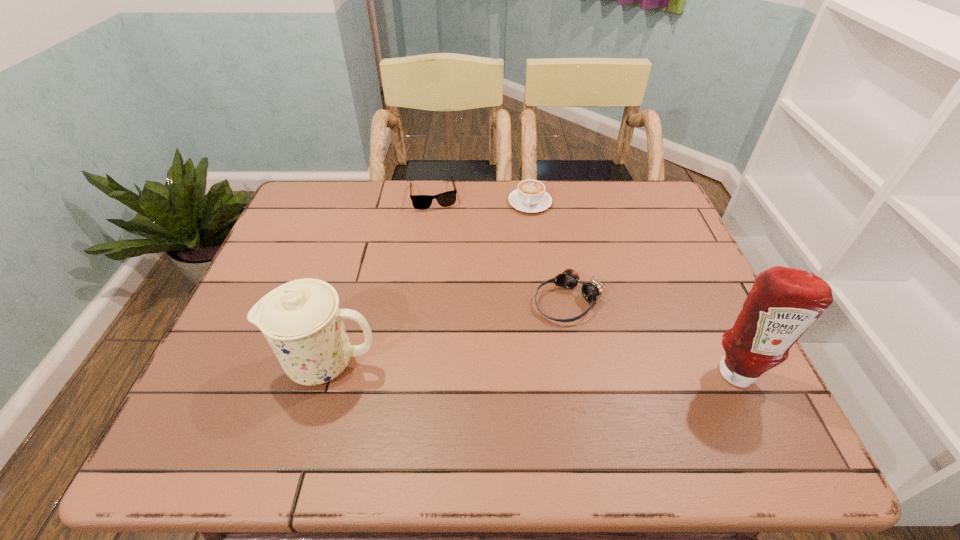
Where is `vacant space on the desktop that is between the fourth shortest object and the condiment and is positioned on the side of the cappuccino with the handle`? The image size is (960, 540). vacant space on the desktop that is between the fourth shortest object and the condiment and is positioned on the side of the cappuccino with the handle is located at coordinates (489, 366).

The height and width of the screenshot is (540, 960). I want to click on free space on the desktop that is between the chinaware and the tallest object and is positioned through the lenses of the third farthest object, so click(497, 366).

Where is `free spot on the desktop that is between the chinaware and the rightmost object and is positioned on the front-facing side of the sunglasses`? free spot on the desktop that is between the chinaware and the rightmost object and is positioned on the front-facing side of the sunglasses is located at coordinates (478, 366).